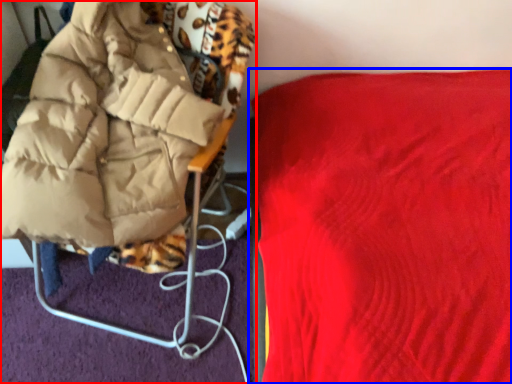
Question: Among these objects, which one is nearest to the camera, furniture (highlighted by a red box) or furniture (highlighted by a blue box)?

Choices:
 (A) furniture
 (B) furniture

Answer: (B)